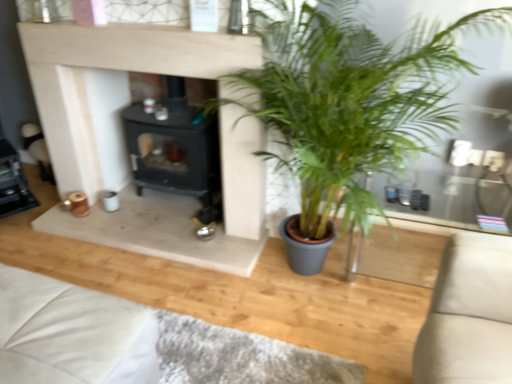
Question: From a real-world perspective, is green leafy plant at center located beneath black matte fireplace at center?

Choices:
 (A) yes
 (B) no

Answer: (B)

Question: Is black matte fireplace at center at the back of green leafy plant at center?

Choices:
 (A) no
 (B) yes

Answer: (A)

Question: Is black matte fireplace at center completely or partially inside green leafy plant at center?

Choices:
 (A) yes
 (B) no

Answer: (B)

Question: Considering the relative sizes of green leafy plant at center and black matte fireplace at center in the image provided, is green leafy plant at center thinner than black matte fireplace at center?

Choices:
 (A) no
 (B) yes

Answer: (A)

Question: Considering the relative positions of green leafy plant at center and black matte fireplace at center in the image provided, is green leafy plant at center behind black matte fireplace at center?

Choices:
 (A) no
 (B) yes

Answer: (A)

Question: Considering the positions of point (90, 317) and point (267, 109), is point (90, 317) closer or farther from the camera than point (267, 109)?

Choices:
 (A) closer
 (B) farther

Answer: (A)

Question: Is white leather couch at lower left to the left or to the right of green leafy plant at center in the image?

Choices:
 (A) right
 (B) left

Answer: (B)

Question: Considering the positions of white leather couch at lower left and green leafy plant at center in the image, is white leather couch at lower left taller or shorter than green leafy plant at center?

Choices:
 (A) tall
 (B) short

Answer: (B)

Question: From a real-world perspective, is white leather couch at lower left above or below green leafy plant at center?

Choices:
 (A) above
 (B) below

Answer: (B)

Question: Is white leather couch at lower left taller or shorter than black matte fireplace at center?

Choices:
 (A) tall
 (B) short

Answer: (B)

Question: Would you say white leather couch at lower left is to the left or to the right of black matte fireplace at center in the picture?

Choices:
 (A) right
 (B) left

Answer: (B)

Question: Considering the positions of white leather couch at lower left and black matte fireplace at center in the image, is white leather couch at lower left bigger or smaller than black matte fireplace at center?

Choices:
 (A) big
 (B) small

Answer: (B)

Question: Considering their positions, is white leather couch at lower left located in front of or behind black matte fireplace at center?

Choices:
 (A) front
 (B) behind

Answer: (A)

Question: Looking at their shapes, would you say black matte fireplace at center is wider or thinner than green leafy plant at center?

Choices:
 (A) thin
 (B) wide

Answer: (A)

Question: From a real-world perspective, is black matte fireplace at center physically located above or below green leafy plant at center?

Choices:
 (A) below
 (B) above

Answer: (A)